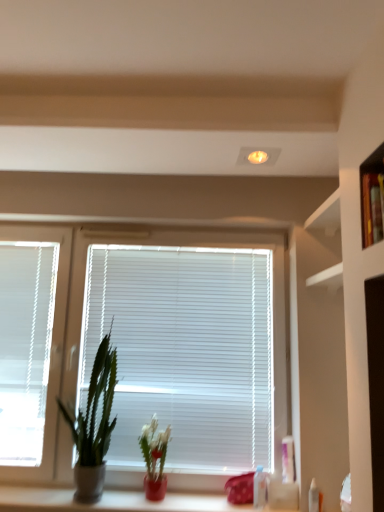
Question: Looking at the image, does matte ceramic plant at lower center, placed as the first houseplant when sorted from right to left, seem bigger or smaller compared to white plastic blinds at left?

Choices:
 (A) big
 (B) small

Answer: (B)

Question: Considering the positions of matte ceramic plant at lower center, placed as the first houseplant when sorted from right to left, and white plastic blinds at left in the image, is matte ceramic plant at lower center, placed as the first houseplant when sorted from right to left, wider or thinner than white plastic blinds at left?

Choices:
 (A) wide
 (B) thin

Answer: (A)

Question: Which object is the farthest from the transparent plastic bottle at lower right, the 2th toiletry in the front-to-back sequence?

Choices:
 (A) white plastic blinds at center
 (B) matte ceramic plant at lower center, placed as the first houseplant when sorted from right to left
 (C) white plastic blinds at left
 (D) white plastic bottle at lower right, the first toiletry in the right-to-left sequence
 (E) green matte plant at left, the second houseplant in the right-to-left sequence

Answer: (C)

Question: Estimate the real-world distances between objects in this image. Which object is closer to the white plastic blinds at center?

Choices:
 (A) transparent plastic bottle at lower right, which is counted as the first toiletry, starting from the left
 (B) green matte plant at left, the second houseplant in the right-to-left sequence
 (C) white glossy counter at lower center
 (D) white plastic blinds at left
 (E) white plastic bottle at lower right, the first toiletry in the right-to-left sequence

Answer: (B)